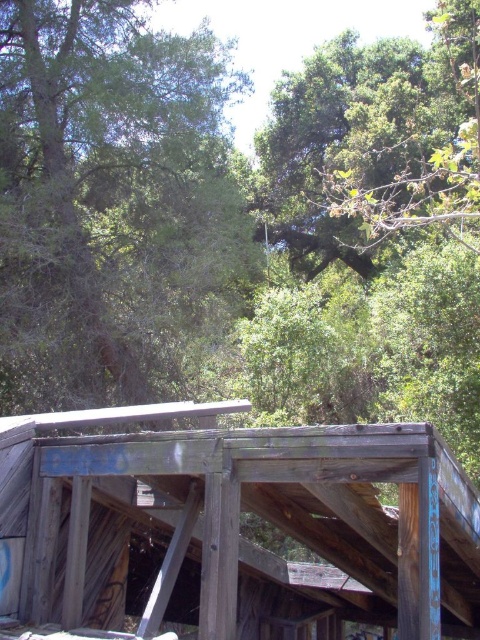
Question: Can you confirm if weathered wood shelter at center is positioned to the right of green leafy tree at upper center?

Choices:
 (A) no
 (B) yes

Answer: (B)

Question: Considering the relative positions of weathered wood shelter at center and green leafy tree at upper center in the image provided, where is weathered wood shelter at center located with respect to green leafy tree at upper center?

Choices:
 (A) right
 (B) left

Answer: (A)

Question: Is weathered wood shelter at center below green leafy tree at upper center?

Choices:
 (A) no
 (B) yes

Answer: (B)

Question: Which point is farther from the camera taking this photo?

Choices:
 (A) [x=335, y=435]
 (B) [x=48, y=195]

Answer: (B)